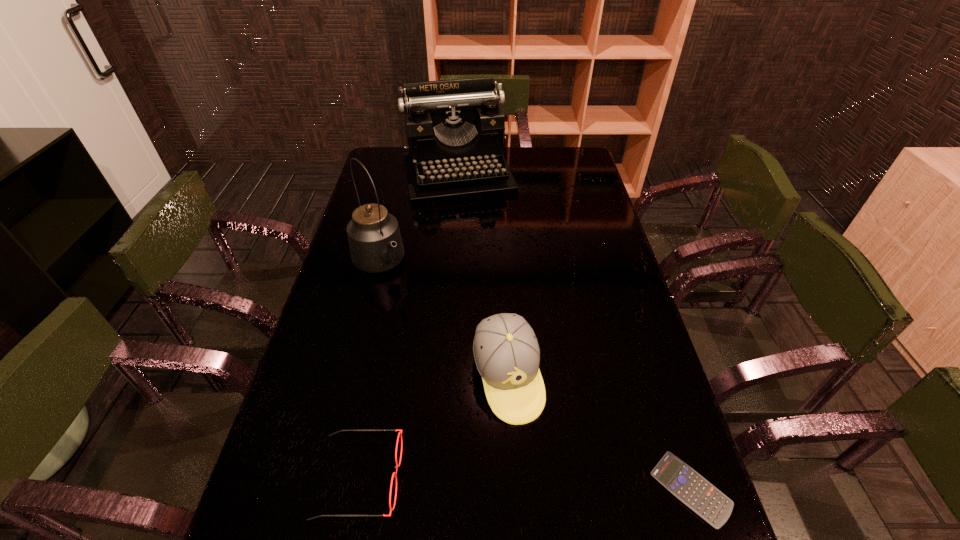
Where is `spectacles`? spectacles is located at coordinates (394, 474).

Locate an element on the screen. the shortest object is located at coordinates (687, 485).

You are a GUI agent. You are given a task and a screenshot of the screen. Output one action in this format:
    pyautogui.click(x=<x>, y=<y>)
    Task: Click on the rightmost object
    This screenshot has width=960, height=540.
    Given the screenshot: What is the action you would take?
    pyautogui.click(x=687, y=485)

At what (x,y) coordinates should I click in order to perform the action: click on baseball cap. Please return your answer as a coordinate pair (x, y). Looking at the image, I should click on (506, 352).

Identify the location of the third nearest object. Image resolution: width=960 pixels, height=540 pixels. (506, 352).

This screenshot has height=540, width=960. I want to click on the second farthest object, so click(375, 242).

This screenshot has height=540, width=960. What are the coordinates of `the farthest object` in the screenshot? It's located at (455, 129).

The height and width of the screenshot is (540, 960). I want to click on free space located on the front-facing side of the spectacles, so click(525, 477).

Find the location of `free space located on the left of the calculator`. free space located on the left of the calculator is located at coordinates (540, 489).

The height and width of the screenshot is (540, 960). In order to click on vacant point located 0.080m on the front-facing side of the baseball cap in this screenshot , I will do `click(530, 457)`.